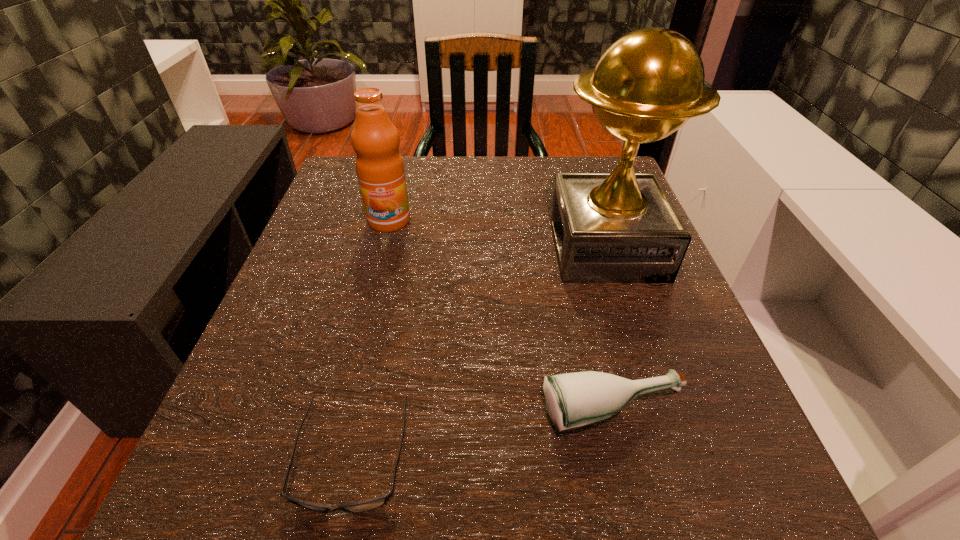
The width and height of the screenshot is (960, 540). I want to click on free space between the award and the bottle, so click(610, 331).

What are the coordinates of `free space between the shortest object and the tallest object` in the screenshot? It's located at [479, 353].

Where is `free space that is in between the tallest object and the sunglasses`? The image size is (960, 540). free space that is in between the tallest object and the sunglasses is located at coordinates (479, 353).

The image size is (960, 540). Find the location of `object that is the second nearest to the bottle`. object that is the second nearest to the bottle is located at coordinates [621, 227].

Locate an element on the screen. object identified as the second closest to the second shortest object is located at coordinates (621, 227).

You are a GUI agent. You are given a task and a screenshot of the screen. Output one action in this format:
    pyautogui.click(x=<x>, y=<y>)
    Task: Click on the free spot that satisfies the following two spatial constraints: 1. on the front-facing side of the tallest object; 2. on the front-facing side of the sunglasses
    This screenshot has width=960, height=540.
    Given the screenshot: What is the action you would take?
    pyautogui.click(x=676, y=458)

Image resolution: width=960 pixels, height=540 pixels. I want to click on free point that satisfies the following two spatial constraints: 1. on the label side of the bottle; 2. on the left side of the fruit juice, so click(340, 414).